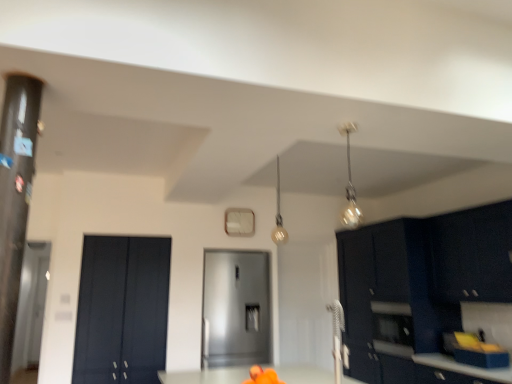
Question: From the image's perspective, is metallic glass pendant light at upper right, acting as the first light fixture starting from the right, positioned above or below matte black cabinets at right, which ranks as the 2th cabinetry in front-to-back order?

Choices:
 (A) below
 (B) above

Answer: (B)

Question: Is metallic glass pendant light at upper right, acting as the first light fixture starting from the right, inside or outside of matte black cabinets at right, which ranks as the 2th cabinetry in front-to-back order?

Choices:
 (A) outside
 (B) inside

Answer: (A)

Question: Which object is the closest to the matte black cabinets at right, which ranks as the 2th cabinetry in front-to-back order?

Choices:
 (A) satin metallic refrigerator at center, the 2th door in the left-to-right sequence
 (B) matte gold light fixture at upper center, placed as the 2th light fixture when sorted from front to back
 (C) matte black cabinet at left, the 1th door when ordered from left to right
 (D) transparent glass door at left
 (E) metallic glass pendant light at upper right, marked as the 1th light fixture in a front-to-back arrangement

Answer: (E)

Question: Which is nearer to the transparent glass door at left?

Choices:
 (A) satin metallic refrigerator at center, the 2th door in the left-to-right sequence
 (B) metallic glass pendant light at upper right, marked as the 1th light fixture in a front-to-back arrangement
 (C) matte black cabinets at right, which ranks as the 2th cabinetry in front-to-back order
 (D) matte black cabinet at left, the 1th door when ordered from left to right
 (E) glossy dark blue cabinet at upper right, the first cabinetry viewed from the front

Answer: (D)